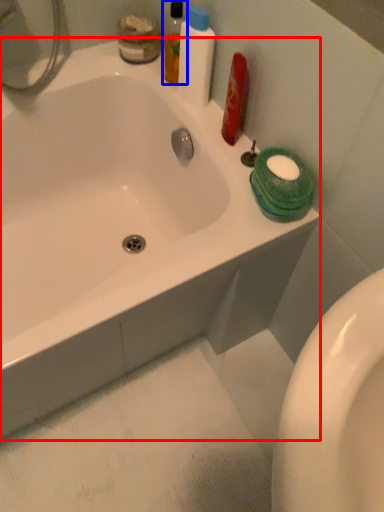
Question: Among these objects, which one is farthest to the camera, bathtub (highlighted by a red box) or mouthwash (highlighted by a blue box)?

Choices:
 (A) bathtub
 (B) mouthwash

Answer: (B)